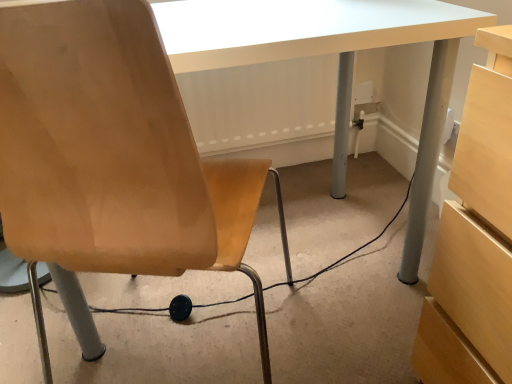
This screenshot has height=384, width=512. In order to click on free space above black rubber cable at lower center (from a real-world perspective) in this screenshot , I will do `click(234, 302)`.